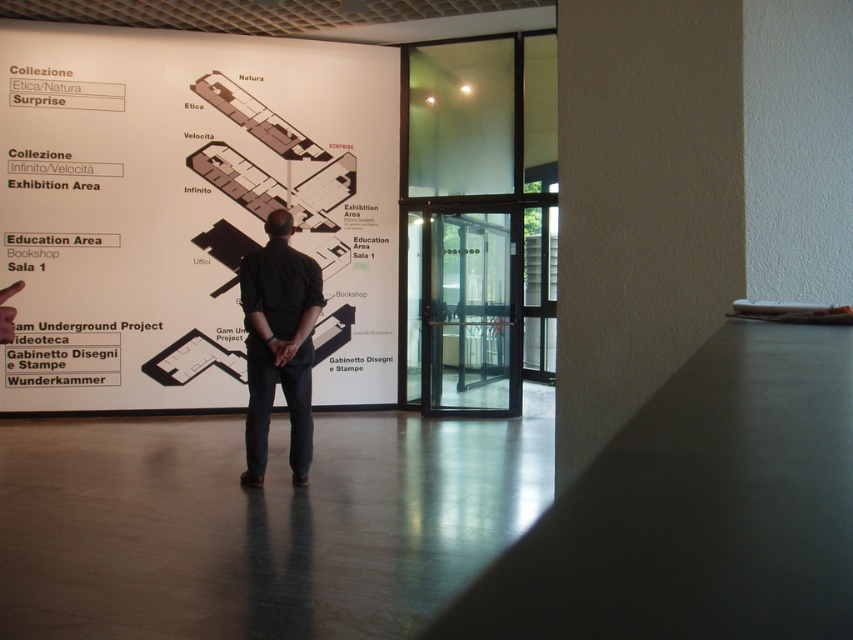
You are standing in front of the informational wall map in the museum. You have a white paper at upper left that you need to place on the map. Which section of the map should you place it near based on its current position?

The white paper at upper left is located at point (189, 211), so it should be placed near the Collezione Etica Natura section on the map.

You are a visitor in the museum and want to take a photo of the white paper at upper left and the black cotton shirt at center. However, you can only focus on one object at a time. Which object should you focus on first to ensure both are in the frame?

You should focus on the white paper at upper left first because it is taller than the black cotton shirt at center, so adjusting the camera to include its height will naturally include the shorter black cotton shirt at center in the frame.